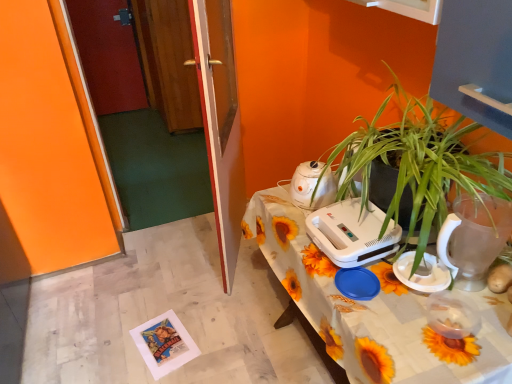
The image size is (512, 384). In order to click on vacant space situated on the left part of white plastic kettle at center, the 4th appliance viewed from the front in this screenshot , I will do `click(280, 201)`.